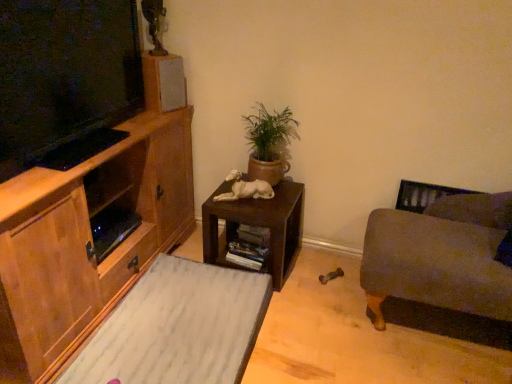
I want to click on vacant space to the right of dark brown wooden table at center, so click(317, 279).